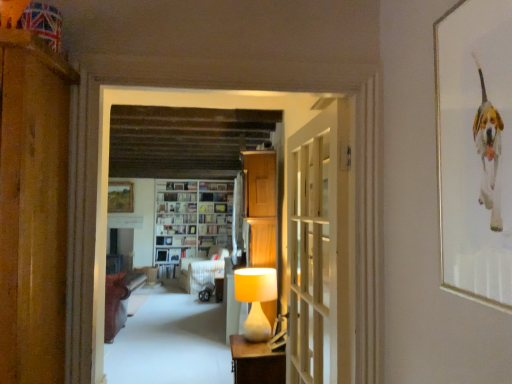
Question: From the image's perspective, is white glossy bookshelf at center, which is the third book from top to bottom, located above brown leather sofa at left, which is the third furniture in right-to-left order?

Choices:
 (A) no
 (B) yes

Answer: (B)

Question: Considering the relative sizes of white glossy bookshelf at center, arranged as the third book when ordered from the bottom, and brown leather sofa at left, which is the second furniture from front to back, in the image provided, is white glossy bookshelf at center, arranged as the third book when ordered from the bottom, taller than brown leather sofa at left, which is the second furniture from front to back,?

Choices:
 (A) no
 (B) yes

Answer: (A)

Question: Is white glossy bookshelf at center, which is the third book from top to bottom, closer to camera compared to brown leather sofa at left, which is the second furniture from front to back?

Choices:
 (A) no
 (B) yes

Answer: (A)

Question: Is white glossy bookshelf at center, arranged as the third book when ordered from the bottom, further to the viewer compared to brown leather sofa at left, which is the second furniture from front to back?

Choices:
 (A) yes
 (B) no

Answer: (A)

Question: Can you confirm if white glossy bookshelf at center, arranged as the third book when ordered from the bottom, is smaller than brown leather sofa at left, which is the third furniture in right-to-left order?

Choices:
 (A) yes
 (B) no

Answer: (A)

Question: In terms of size, does white paper bookshelf at center, the fourth book in the bottom-to-top sequence, appear bigger or smaller than hardcover book at center, marked as the fourth book in a top-to-bottom arrangement?

Choices:
 (A) small
 (B) big

Answer: (A)

Question: Considering the positions of point (222, 220) and point (159, 248), is point (222, 220) closer or farther from the camera than point (159, 248)?

Choices:
 (A) closer
 (B) farther

Answer: (B)

Question: From a real-world perspective, is white paper bookshelf at center, which is the 2th book from top to bottom, positioned above or below hardcover book at center, the 2th book positioned from the bottom?

Choices:
 (A) above
 (B) below

Answer: (A)

Question: In terms of width, does white paper bookshelf at center, which is the 2th book from top to bottom, look wider or thinner when compared to hardcover book at center, the 2th book positioned from the bottom?

Choices:
 (A) wide
 (B) thin

Answer: (A)

Question: From the image's perspective, is wooden cabinet at center located above or below matte wooden table at center?

Choices:
 (A) below
 (B) above

Answer: (B)

Question: Considering the positions of wooden cabinet at center and matte wooden table at center in the image, is wooden cabinet at center bigger or smaller than matte wooden table at center?

Choices:
 (A) big
 (B) small

Answer: (A)

Question: Is point (272, 221) closer or farther from the camera than point (223, 281)?

Choices:
 (A) farther
 (B) closer

Answer: (B)

Question: From a real-world perspective, is wooden cabinet at center physically located above or below matte wooden table at center?

Choices:
 (A) above
 (B) below

Answer: (A)

Question: From a real-world perspective, is white fabric sofa at center, the 1th furniture when ordered from back to front, physically located above or below white fabric curtain at center?

Choices:
 (A) below
 (B) above

Answer: (A)

Question: Looking at their shapes, would you say white fabric sofa at center, which is the 2th furniture from left to right, is wider or thinner than white fabric curtain at center?

Choices:
 (A) wide
 (B) thin

Answer: (A)